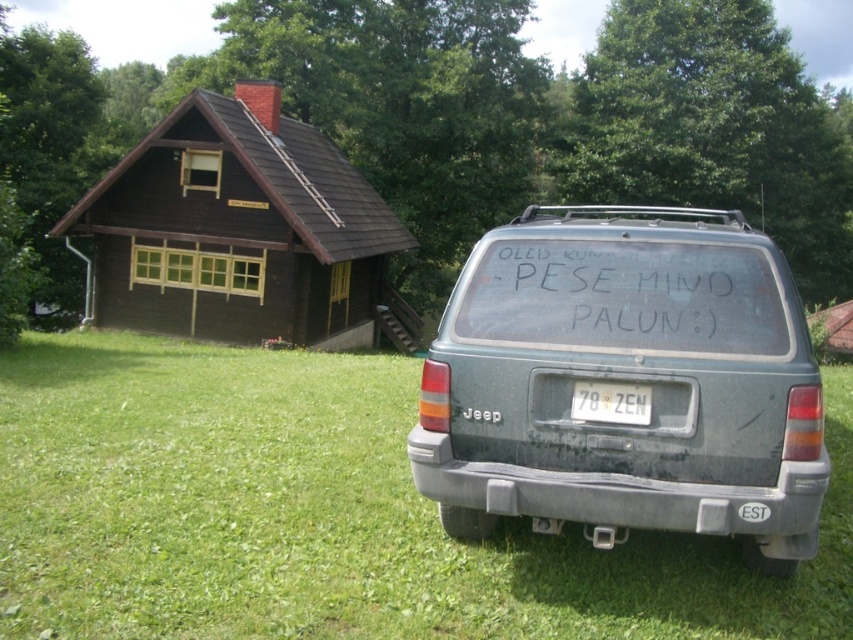
You are standing in the middle of the green grass at center and want to place a small garden ornament. Considering the size of the black matte text at rear, will there be enough space to place it without overlapping?

The green grass at center is bigger than the black matte text at rear, so there should be enough space to place the garden ornament without overlapping.